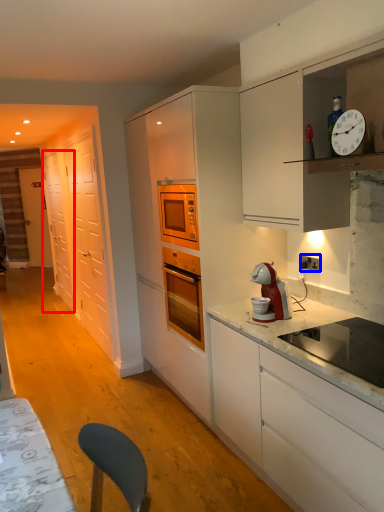
Question: Which of the following is the closest to the observer, glass door (highlighted by a red box) or electric outlet (highlighted by a blue box)?

Choices:
 (A) glass door
 (B) electric outlet

Answer: (B)